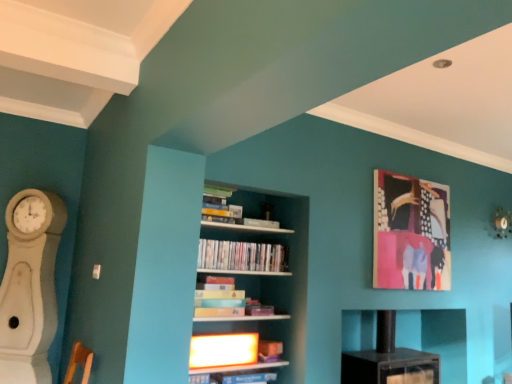
Question: Is abstract painting at upper right not inside matte cardboard book at center, the 2th book from the bottom?

Choices:
 (A) no
 (B) yes

Answer: (B)

Question: Does abstract painting at upper right have a lesser height compared to matte cardboard book at center, arranged as the third book when viewed from the top?

Choices:
 (A) yes
 (B) no

Answer: (B)

Question: Considering the relative sizes of abstract painting at upper right and matte cardboard book at center, arranged as the third book when viewed from the top, in the image provided, is abstract painting at upper right smaller than matte cardboard book at center, arranged as the third book when viewed from the top,?

Choices:
 (A) yes
 (B) no

Answer: (B)

Question: Does abstract painting at upper right turn towards matte cardboard book at center, the 2th book from the bottom?

Choices:
 (A) yes
 (B) no

Answer: (B)

Question: From a real-world perspective, is abstract painting at upper right positioned over matte cardboard book at center, arranged as the third book when viewed from the top, based on gravity?

Choices:
 (A) no
 (B) yes

Answer: (B)

Question: Is white wooden bookcase at center bigger or smaller than matte cardboard book at center, the 2th book from the bottom?

Choices:
 (A) small
 (B) big

Answer: (B)

Question: Is point (264, 286) closer or farther from the camera than point (230, 284)?

Choices:
 (A) closer
 (B) farther

Answer: (B)

Question: Which is correct: white wooden bookcase at center is inside matte cardboard book at center, arranged as the third book when viewed from the top, or outside of it?

Choices:
 (A) inside
 (B) outside

Answer: (B)

Question: Would you say white wooden bookcase at center is to the left or to the right of matte cardboard book at center, arranged as the third book when viewed from the top, in the picture?

Choices:
 (A) right
 (B) left

Answer: (A)

Question: From the image's perspective, relative to matte white shelf at center, which is the second shelf in right-to-left order, is matte black shelf at center, which ranks as the 1th shelf in back-to-front order, above or below?

Choices:
 (A) below
 (B) above

Answer: (A)

Question: Is matte black shelf at center, which is the second shelf from left to right, to the left or to the right of matte white shelf at center, which is the second shelf in right-to-left order, in the image?

Choices:
 (A) right
 (B) left

Answer: (A)

Question: From a real-world perspective, is matte black shelf at center, which is the second shelf from left to right, above or below matte white shelf at center, acting as the second shelf starting from the back?

Choices:
 (A) above
 (B) below

Answer: (B)

Question: Is matte black shelf at center, which ranks as the 1th shelf in back-to-front order, wider or thinner than matte white shelf at center, which is the second shelf in right-to-left order?

Choices:
 (A) wide
 (B) thin

Answer: (A)

Question: Considering the positions of white wood fireplace at left and white wooden bookcase at center in the image, is white wood fireplace at left bigger or smaller than white wooden bookcase at center?

Choices:
 (A) big
 (B) small

Answer: (B)

Question: From the image's perspective, is white wood fireplace at left above or below white wooden bookcase at center?

Choices:
 (A) above
 (B) below

Answer: (B)